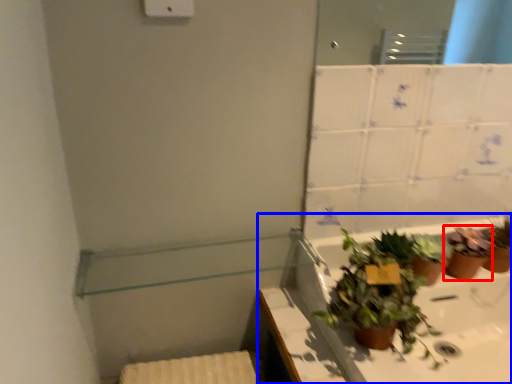
Question: Which object appears farthest to the camera in this image, houseplant (highlighted by a red box) or bath (highlighted by a blue box)?

Choices:
 (A) houseplant
 (B) bath

Answer: (A)